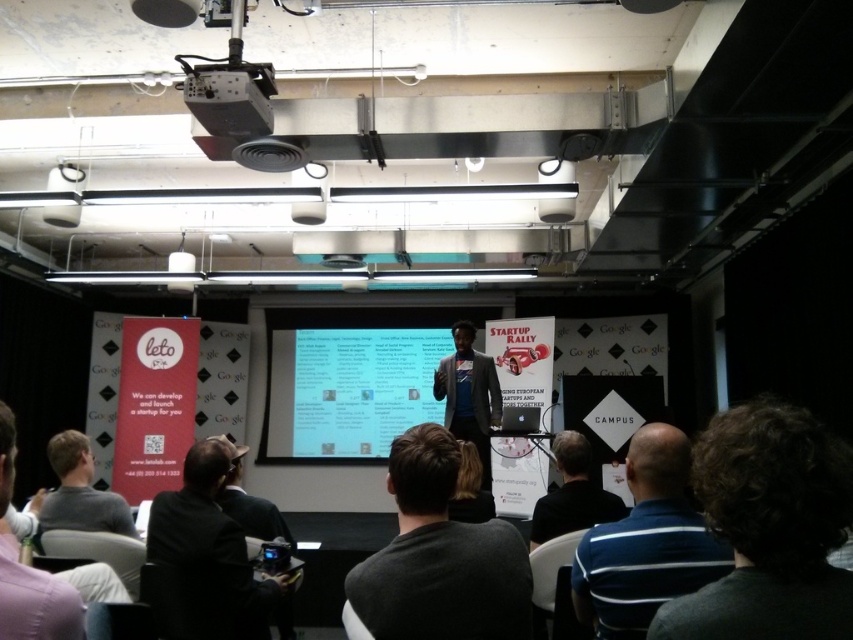
Question: Which of these objects is positioned farthest from the dark gray shirt at lower center?

Choices:
 (A) dark gray sweater at center
 (B) white matte projection screen at center
 (C) dark curly hair at lower right
 (D) blue striped shirt at lower right

Answer: (B)

Question: Which is nearer to the blue t-shirt at center?

Choices:
 (A) dark curly hair at lower right
 (B) matte black projector at upper center

Answer: (B)

Question: Where is dark gray shirt at lower center located in relation to dark gray jacket at lower center in the image?

Choices:
 (A) left
 (B) right

Answer: (B)

Question: Among these points, which one is farthest from the camera?

Choices:
 (A) (665, 525)
 (B) (88, 484)
 (C) (221, 499)

Answer: (C)

Question: Is blue t-shirt at center below dark gray jacket at lower center?

Choices:
 (A) yes
 (B) no

Answer: (A)

Question: Is white matte projection screen at center bigger than dark gray shirt at lower center?

Choices:
 (A) no
 (B) yes

Answer: (B)